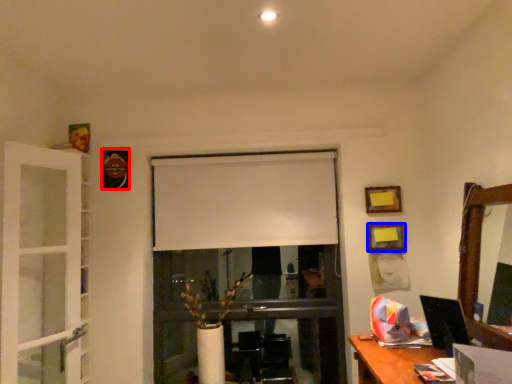
Question: Which point is further to the camera, picture frame (highlighted by a red box) or picture frame (highlighted by a blue box)?

Choices:
 (A) picture frame
 (B) picture frame

Answer: (A)